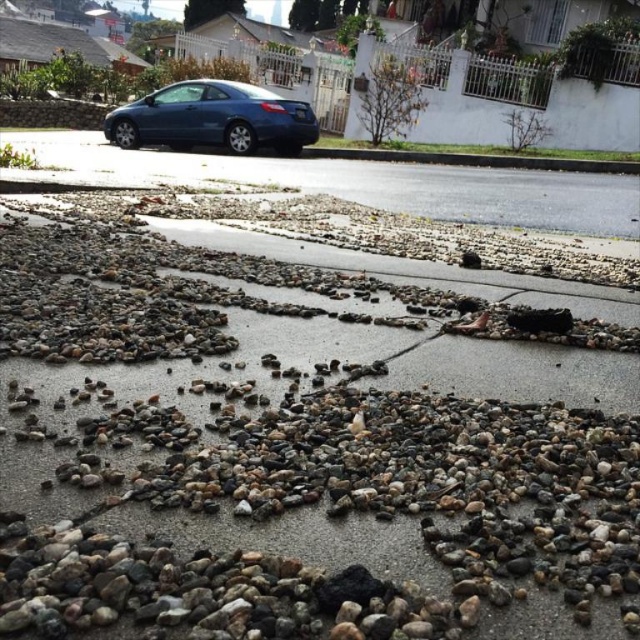
Question: Which point is closer to the camera?

Choices:
 (A) 176,259
 (B) 113,124

Answer: (A)

Question: Can you confirm if multicolored pebbles at center is positioned above matte blue car at center?

Choices:
 (A) no
 (B) yes

Answer: (A)

Question: Is multicolored pebbles at center to the right of matte blue car at center from the viewer's perspective?

Choices:
 (A) yes
 (B) no

Answer: (A)

Question: Does multicolored pebbles at center have a smaller size compared to matte blue car at center?

Choices:
 (A) no
 (B) yes

Answer: (B)

Question: Which object is farther from the camera taking this photo?

Choices:
 (A) matte blue car at center
 (B) multicolored pebbles at center

Answer: (A)

Question: Which point is farther to the camera?

Choices:
 (A) multicolored pebbles at center
 (B) matte blue car at center

Answer: (B)